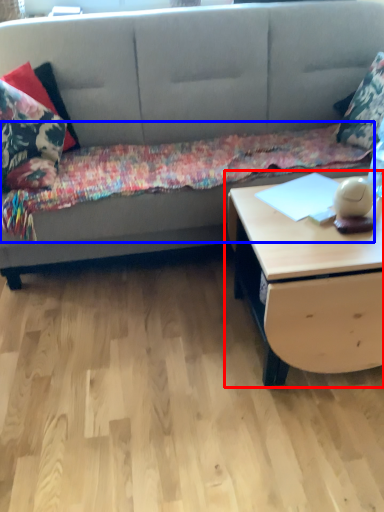
Question: Which of the following is the farthest to the observer, table (highlighted by a red box) or blanket (highlighted by a blue box)?

Choices:
 (A) table
 (B) blanket

Answer: (B)